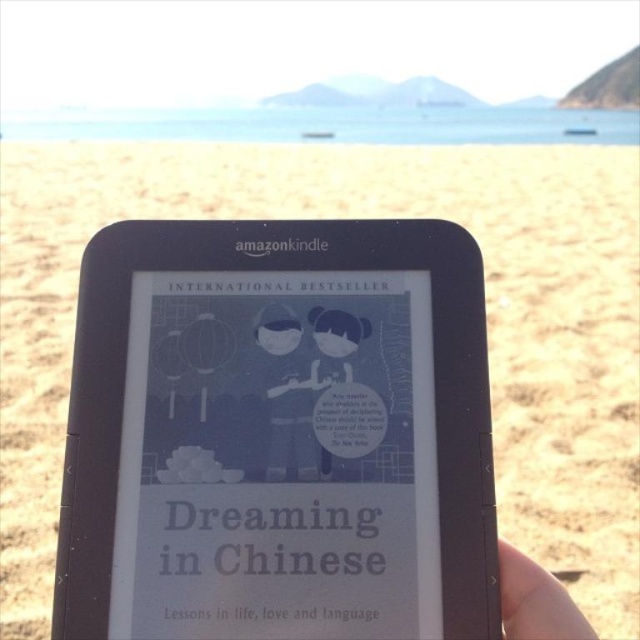
Is smooth skin hand at lower right shorter than matte blue character at center?

Yes, smooth skin hand at lower right is shorter than matte blue character at center.

Who is positioned more to the left, smooth skin hand at lower right or matte blue character at center?

matte blue character at center is more to the left.

Between point (518, 552) and point (323, 336), which one is positioned behind?

The point (323, 336) is behind.

I want to click on smooth skin hand at lower right, so click(536, 600).